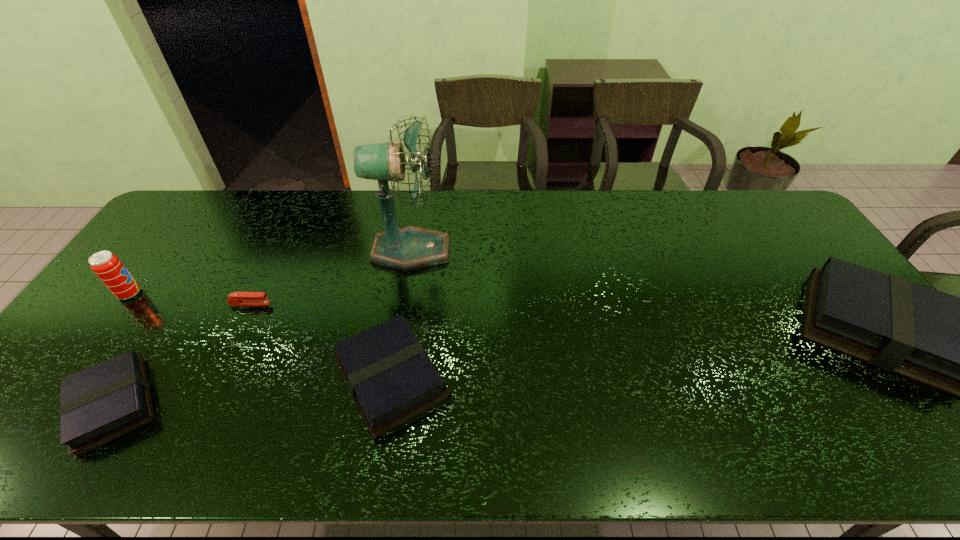
Find the location of a particular element. This screenshot has width=960, height=540. the second object from left to right is located at coordinates (99, 404).

Find the location of a particular element. the second shortest object is located at coordinates (99, 404).

Locate an element on the screen. This screenshot has width=960, height=540. the second book from left to right is located at coordinates (391, 377).

Locate an element on the screen. This screenshot has width=960, height=540. the third shortest object is located at coordinates pyautogui.click(x=391, y=377).

Where is `stapler`? The image size is (960, 540). stapler is located at coordinates (236, 298).

Locate an element on the screen. The image size is (960, 540). the shortest object is located at coordinates (236, 298).

You are a GUI agent. You are given a task and a screenshot of the screen. Output one action in this format:
    pyautogui.click(x=<x>, y=<y>)
    Task: Click on the tallest object
    
    Given the screenshot: What is the action you would take?
    pyautogui.click(x=409, y=248)

In order to click on the leftmost object in this screenshot , I will do `click(107, 266)`.

Identify the location of the second tallest object. The height and width of the screenshot is (540, 960). (107, 266).

At what (x,y) coordinates should I click in order to perform the action: click on free region located 0.100m on the right of the fifth object from right to left. Please return your answer as a coordinate pair (x, y). Looking at the image, I should click on (207, 405).